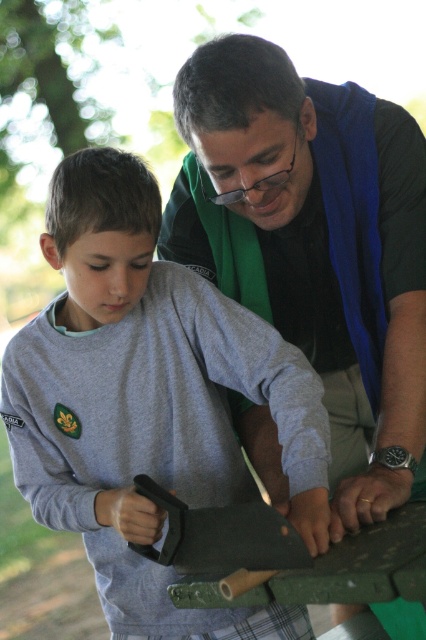
Between gray cotton shirt at center and blue fabric vest at center, which one appears on the right side from the viewer's perspective?

From the viewer's perspective, blue fabric vest at center appears more on the right side.

From the picture: Is gray cotton shirt at center bigger than blue fabric vest at center?

Incorrect, gray cotton shirt at center is not larger than blue fabric vest at center.

Locate an element on the screen. gray cotton shirt at center is located at coordinates pos(149,401).